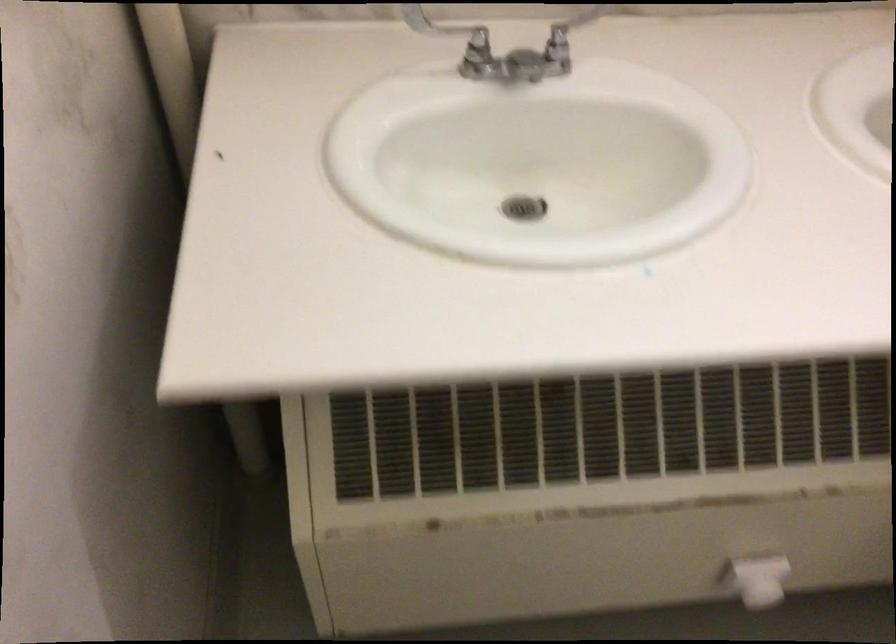
The width and height of the screenshot is (896, 644). What do you see at coordinates (759, 580) in the screenshot?
I see `a white T-shaped handle` at bounding box center [759, 580].